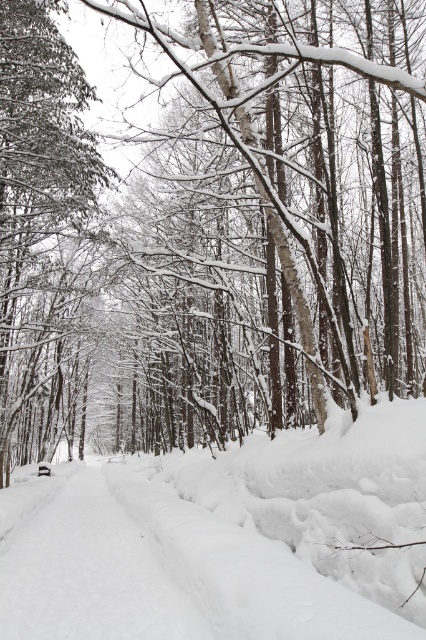
Question: Among these objects, which one is nearest to the camera?

Choices:
 (A) green textured pine at left
 (B) white fluffy snow at center

Answer: (B)

Question: Is white fluffy snow at center smaller than green textured pine at left?

Choices:
 (A) no
 (B) yes

Answer: (B)

Question: Does white fluffy snow at center have a lesser width compared to green textured pine at left?

Choices:
 (A) no
 (B) yes

Answer: (B)

Question: Among these objects, which one is nearest to the camera?

Choices:
 (A) green textured pine at left
 (B) white fluffy snow at center

Answer: (B)

Question: Is white fluffy snow at center thinner than green textured pine at left?

Choices:
 (A) yes
 (B) no

Answer: (A)

Question: Which object is closer to the camera taking this photo?

Choices:
 (A) white fluffy snow at center
 (B) green textured pine at left

Answer: (A)